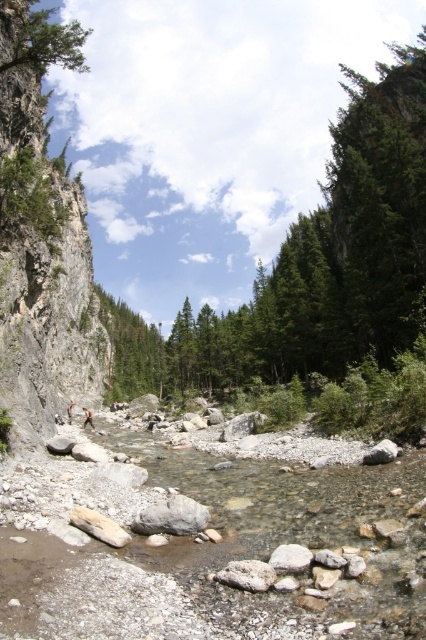
You are a hiker planning to cross the river. You see the rocky cliff at left and the green matte tree at upper left. Which object would provide a better vantage point to observe the riverbed below?

The rocky cliff at left has a larger size compared to the green matte tree at upper left, so it would provide a better vantage point to observe the riverbed below.